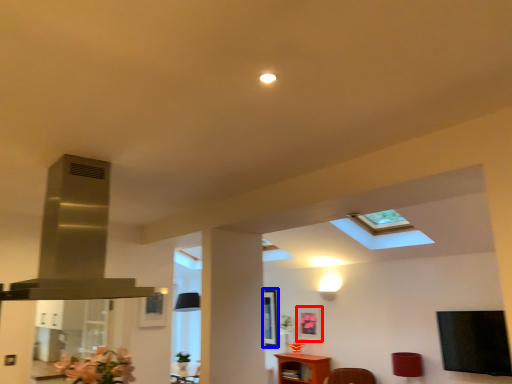
Question: Which point is further to the camera, picture frame (highlighted by a red box) or picture frame (highlighted by a blue box)?

Choices:
 (A) picture frame
 (B) picture frame

Answer: (B)